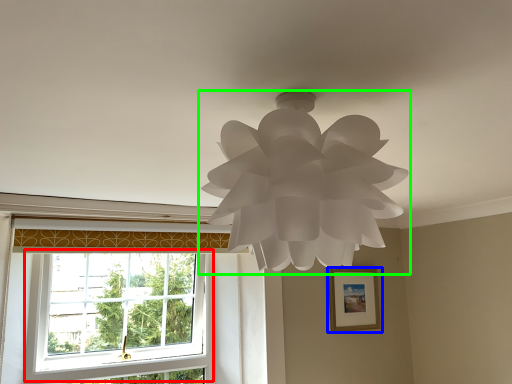
Question: Which object is the closest to the window (highlighted by a red box)? Choose among these: picture frame (highlighted by a blue box) or lamp (highlighted by a green box).

Choices:
 (A) picture frame
 (B) lamp

Answer: (A)